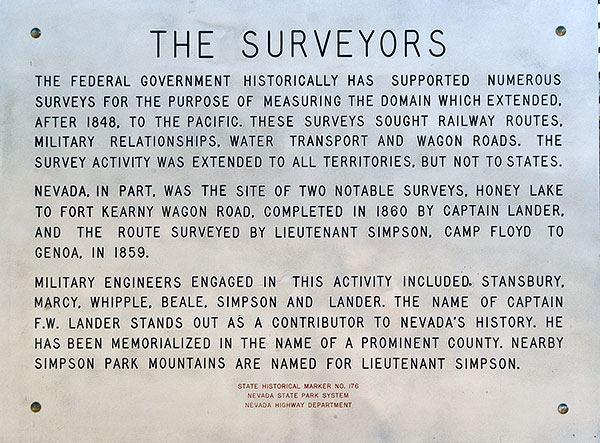
The height and width of the screenshot is (443, 600). I want to click on plaque, so click(307, 252).